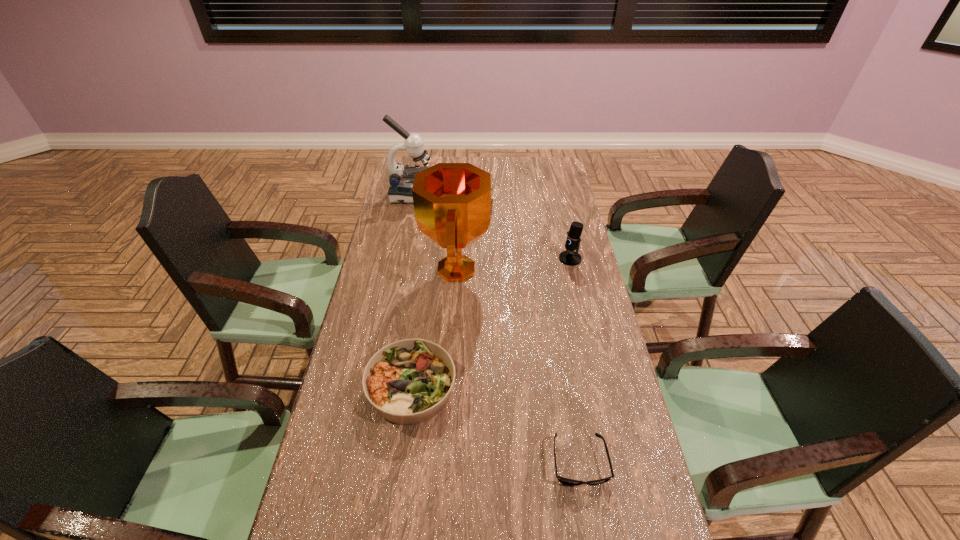
The width and height of the screenshot is (960, 540). In order to click on the farthest object in this screenshot , I will do `click(401, 179)`.

This screenshot has width=960, height=540. Find the location of `award`. award is located at coordinates (453, 208).

At what (x,y) coordinates should I click in order to perform the action: click on the third tallest object. Please return your answer as a coordinate pair (x, y). Image resolution: width=960 pixels, height=540 pixels. Looking at the image, I should click on [x=569, y=257].

The height and width of the screenshot is (540, 960). I want to click on salad plate, so click(x=409, y=381).

The image size is (960, 540). Identify the location of the second nearest object. (409, 381).

Locate an element on the screen. The height and width of the screenshot is (540, 960). the nearest object is located at coordinates (563, 480).

I want to click on sunglasses, so [x=563, y=480].

Identify the location of vacant space located 0.210m on the right of the farthest object. (480, 195).

The height and width of the screenshot is (540, 960). What are the coordinates of `vacant space located on the side of the award with the star emblem` in the screenshot? It's located at (579, 269).

Where is `free space located 0.110m on the back of the third shortest object`? The width and height of the screenshot is (960, 540). free space located 0.110m on the back of the third shortest object is located at coordinates (564, 234).